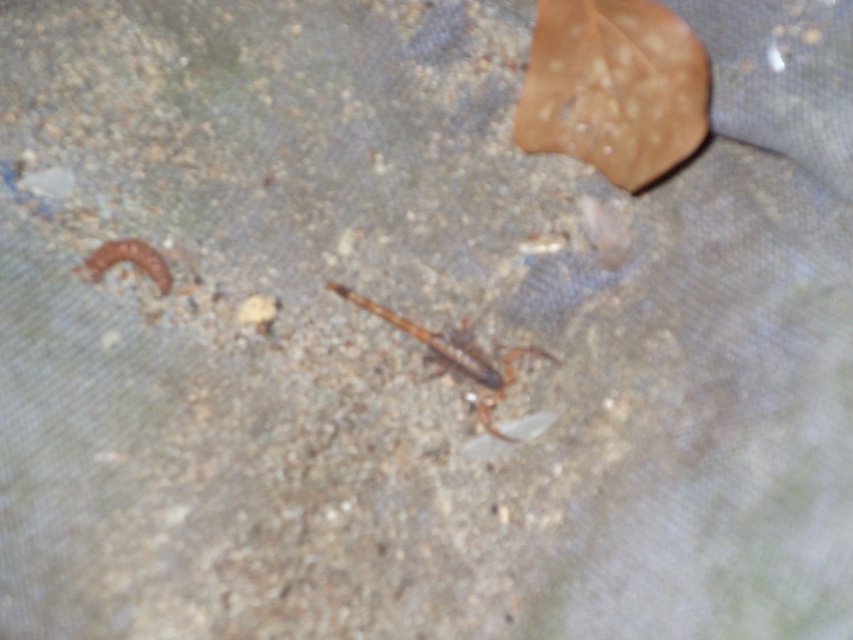
Is point (535, 52) closer to viewer compared to point (511, 436)?

No.

Who is more forward, (682, 49) or (514, 346)?

Point (682, 49) is in front.

This screenshot has height=640, width=853. In order to click on brown matte leaf at upper right in this screenshot , I will do `click(613, 88)`.

Between brown scaly insect at center and brown fuzzy worm at left, which one has less height?

brown fuzzy worm at left is shorter.

Between point (531, 352) and point (167, 276), which one is positioned behind?

The point (531, 352) is more distant.

Where is `brown scaly insect at center`? The image size is (853, 640). brown scaly insect at center is located at coordinates (457, 356).

Is brown matte leaf at upper right bigger than brown fuzzy worm at left?

Correct, brown matte leaf at upper right is larger in size than brown fuzzy worm at left.

Does brown matte leaf at upper right appear under brown fuzzy worm at left?

Incorrect, brown matte leaf at upper right is not positioned below brown fuzzy worm at left.

Is point (660, 4) in front of point (88, 262)?

No, (660, 4) is behind (88, 262).

The height and width of the screenshot is (640, 853). What are the coordinates of `brown matte leaf at upper right` in the screenshot? It's located at (613, 88).